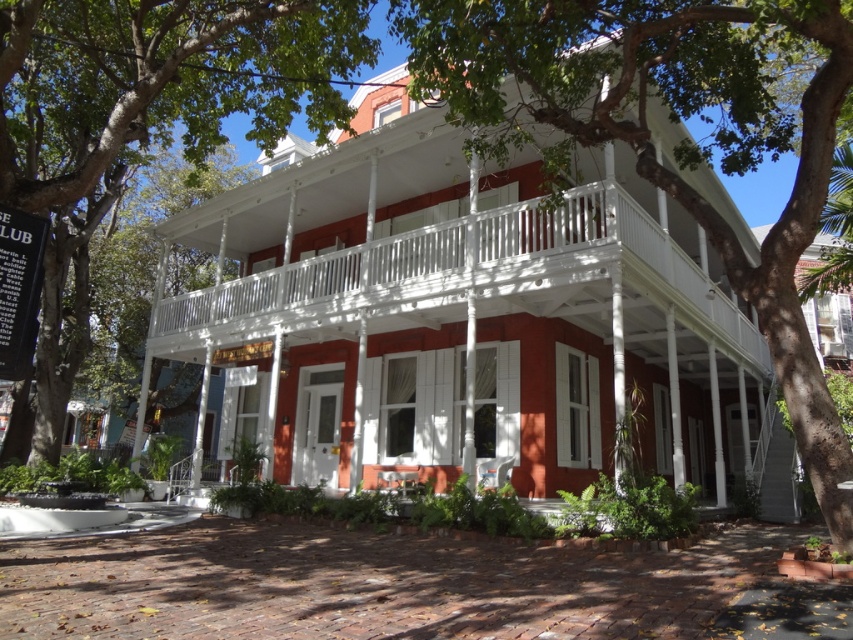
Based on the photo, you are standing in front of the house and want to know which object is taller between the green leafy tree at upper left and the white wooden balcony at center. Can you determine this based on the scene?

The green leafy tree at upper left is taller than the white wooden balcony at center according to the scene description.

You are standing in front of the house and want to take a photo of the green leafy tree at upper left. Where should you position yourself to ensure the tree is in the frame?

The green leafy tree at upper left is located at point (160, 81), so you should position yourself to the left side of the house to capture the tree in your photo.

You are a painter planning to paint the scene of the house. You have a canvas that can only accommodate objects up to the width of the white wooden balcony at center. Will the green leafy tree at upper center fit on your canvas?

The green leafy tree at upper center has a width less than the white wooden balcony at center, so it will fit on the canvas designed for the balcony width.